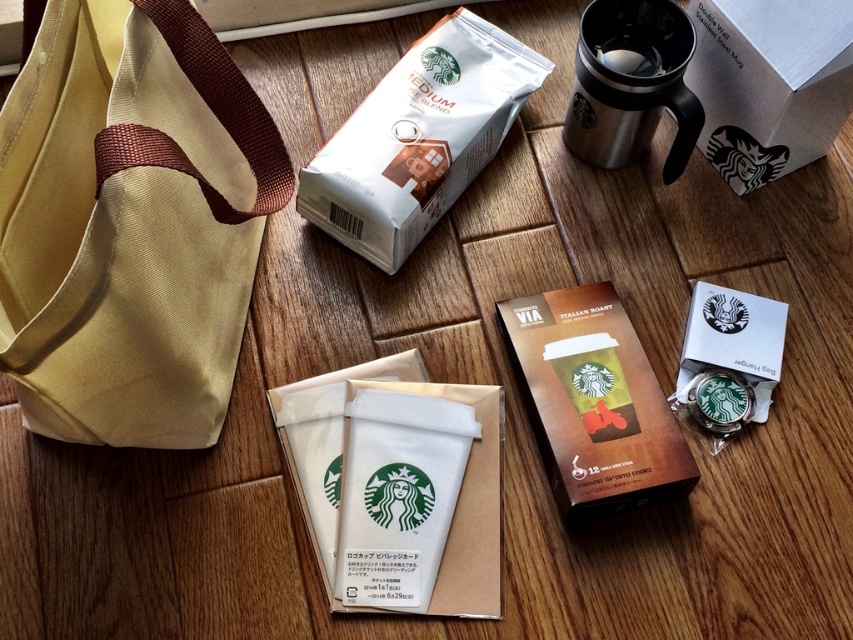
Between beige canvas tote at left and stainless steel mug at upper right, which one appears on the right side from the viewer's perspective?

From the viewer's perspective, stainless steel mug at upper right appears more on the right side.

Does beige canvas tote at left appear on the left side of stainless steel mug at upper right?

Yes, beige canvas tote at left is to the left of stainless steel mug at upper right.

From the picture: Who is more distant from viewer, (218, 209) or (653, 32)?

The point (653, 32) is behind.

Where is `beige canvas tote at left`? beige canvas tote at left is located at coordinates (132, 230).

Does point (811, 157) come farther from viewer compared to point (616, 42)?

Yes, point (811, 157) is behind point (616, 42).

Who is higher up, white cardboard box at upper right or shiny stainless steel coffee cup at upper center?

shiny stainless steel coffee cup at upper center is above.

This screenshot has width=853, height=640. Find the location of `white cardboard box at upper right`. white cardboard box at upper right is located at coordinates (769, 83).

Who is positioned more to the right, white cardboard box at upper right or stainless steel mug at upper right?

white cardboard box at upper right is more to the right.

Is point (798, 52) farther from camera compared to point (685, 157)?

No, it is not.

Who is more distant from viewer, (755, 179) or (680, 52)?

Positioned behind is point (755, 179).

At what (x,y) coordinates should I click in order to perform the action: click on white cardboard box at upper right. Please return your answer as a coordinate pair (x, y). Looking at the image, I should click on (769, 83).